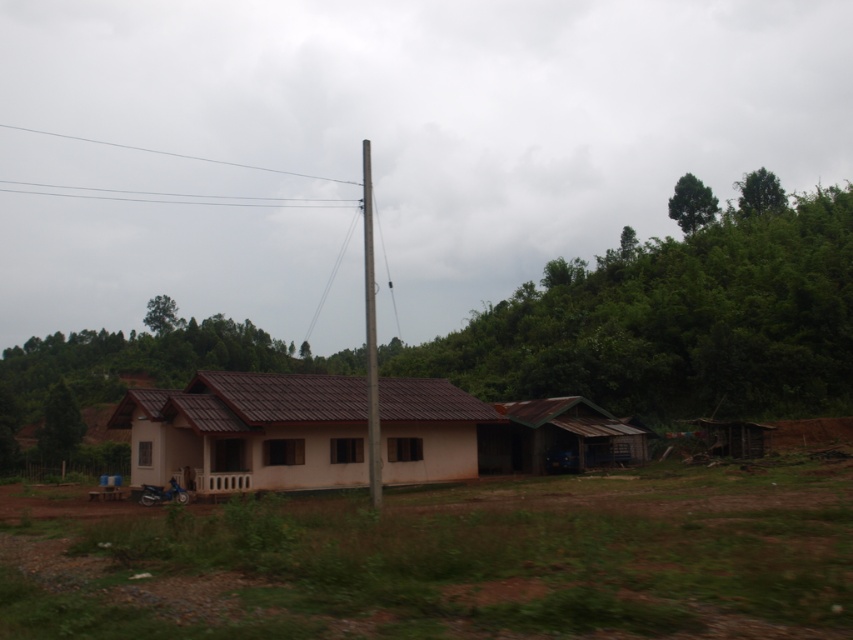
Question: Does brown matte house at center appear on the left side of metallic pole at center?

Choices:
 (A) yes
 (B) no

Answer: (B)

Question: Which point appears farthest from the camera in this image?

Choices:
 (A) (437, 381)
 (B) (366, 292)
 (C) (573, 467)

Answer: (A)

Question: Is brown matte house at center below metallic pole at center?

Choices:
 (A) no
 (B) yes

Answer: (B)

Question: Does brown matte house at center appear on the right side of rusty corrugated tin hut at lower right?

Choices:
 (A) yes
 (B) no

Answer: (B)

Question: Based on their relative distances, which object is farther from the brown matte house at center?

Choices:
 (A) rusty corrugated tin hut at lower right
 (B) metallic pole at center

Answer: (B)

Question: Among these objects, which one is nearest to the camera?

Choices:
 (A) brown matte house at center
 (B) rusty corrugated tin hut at lower right

Answer: (A)